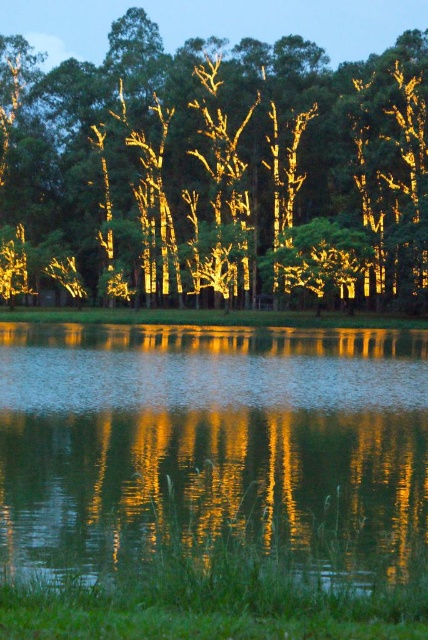
Question: Among these points, which one is farthest from the camera?

Choices:
 (A) (243, 499)
 (B) (281, 182)

Answer: (B)

Question: Does illuminated bark tree at center have a greater width compared to glistening reflective water at bottom?

Choices:
 (A) yes
 (B) no

Answer: (A)

Question: From the image, what is the correct spatial relationship of illuminated bark tree at center in relation to glistening reflective water at bottom?

Choices:
 (A) above
 (B) below

Answer: (A)

Question: Is the position of illuminated bark tree at center more distant than that of glistening reflective water at bottom?

Choices:
 (A) yes
 (B) no

Answer: (A)